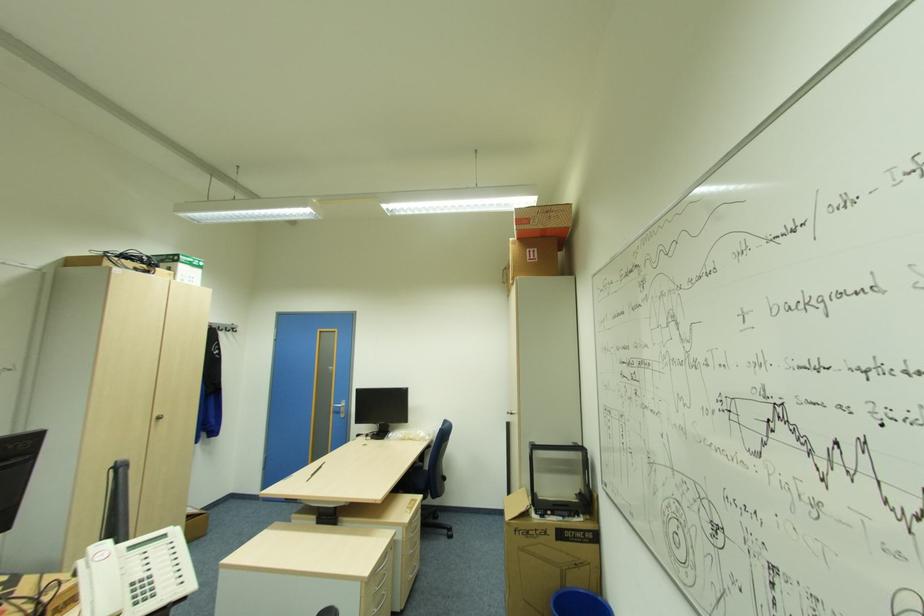
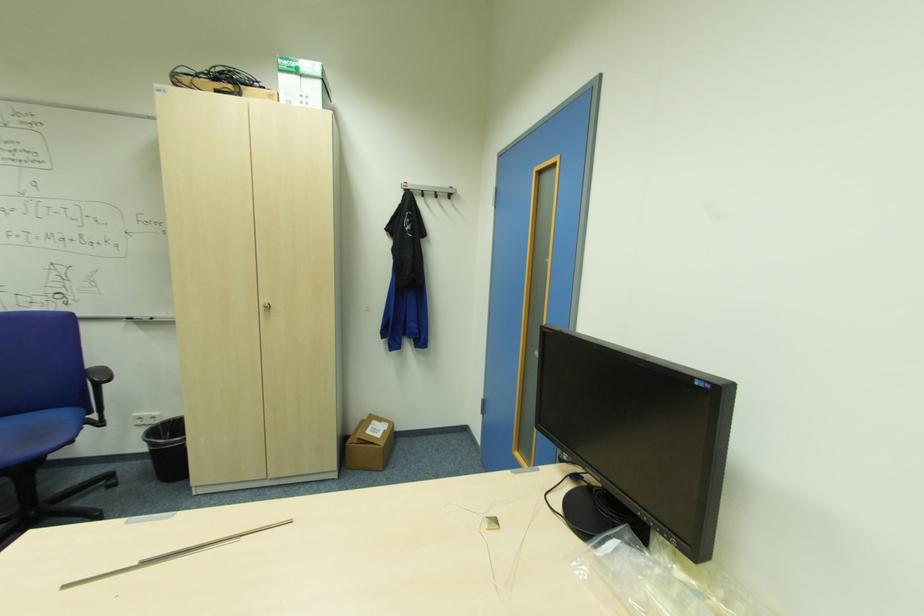
Find the pixel in the second image that matches (x=162, y=418) in the first image.

(271, 307)